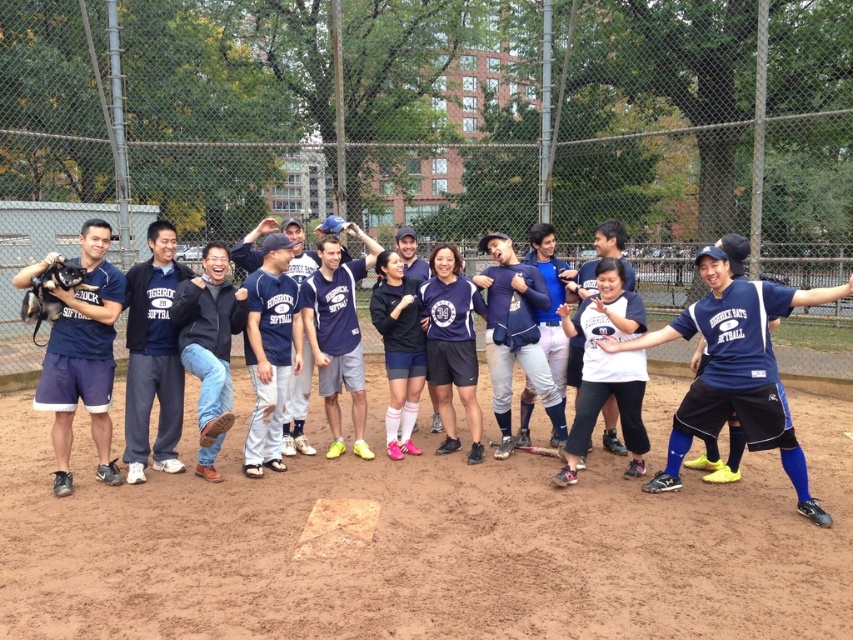
You are standing at the center of the baseball field and want to take a photo of two specific points marked in the image. The first point is at coordinate point (701, 324) and the second is at point (161, 387). Which point is closer to you?

Point (701, 324) is closer to the camera than point (161, 387).

You are a photographer trying to capture a closeup shot of the navy blue jersey at center without the matte blue shorts at left overlapping in the frame. Given their sizes, which object should you focus on to ensure the jersey is centered and the shorts are out of the shot?

The matte blue shorts at left has a smaller size compared to navy blue jersey at center. To avoid overlap, focus on the larger navy blue jersey at center, as its bigger size will dominate the frame and the smaller shorts can be positioned outside the shot.

Consider the image. You are a photographer trying to adjust the composition of the photo. You notice the matte blue shorts at left and the navy blue jersey at center. Which object is covering part of the other?

The matte blue shorts at left is positioned over the navy blue jersey at center, so the shorts are covering part of the jersey.